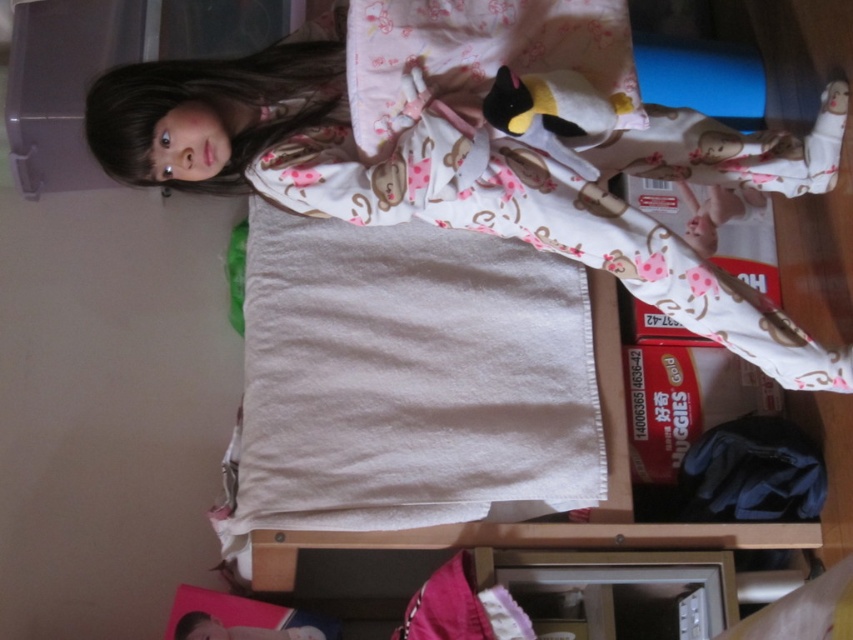
You are a parent checking on your child. You see the white cotton pajamas at upper center and the soft plush penguin at upper center. Which item is wider?

The white cotton pajamas at upper center might be wider than the soft plush penguin at upper center, so the pajamas could be wider.

You are a parent checking on your child in the room. You notice the white cotton pajamas at upper center and the soft plush penguin at upper center. Which item is bigger in size?

The white cotton pajamas at upper center is larger in size than the soft plush penguin at upper center.

You are a parent checking on your child. You notice the soft plush penguin at upper center and the white cotton pajamas at upper center. Which item is closer to you when you look at the child?

The white cotton pajamas at upper center are closer to you because the soft plush penguin at upper center is behind them.